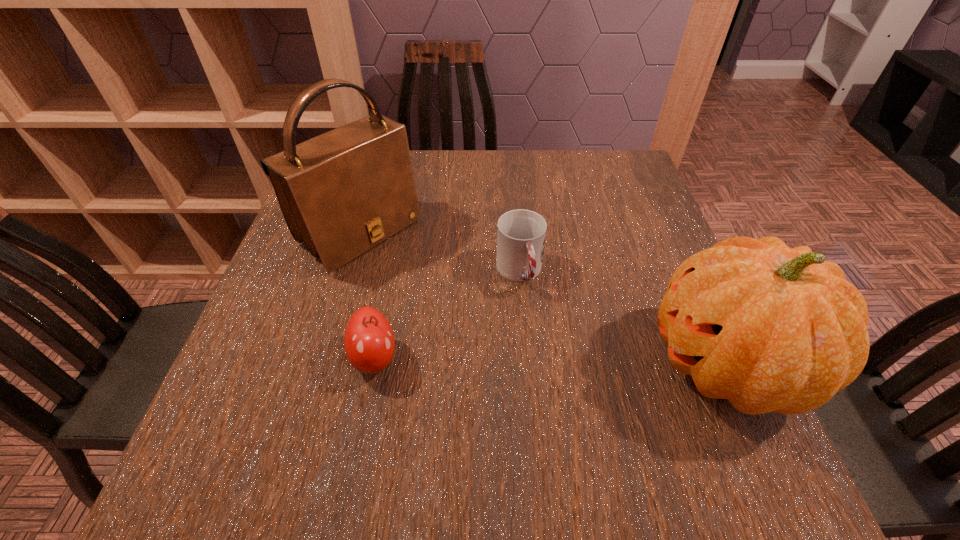
You are a GUI agent. You are given a task and a screenshot of the screen. Output one action in this format:
    pyautogui.click(x=<x>, y=<y>)
    Task: Click on the free spot between the tallest object and the rightmost object
    Image resolution: width=960 pixels, height=540 pixels.
    Given the screenshot: What is the action you would take?
    pyautogui.click(x=543, y=299)

This screenshot has width=960, height=540. I want to click on blank region between the rightmost object and the cup, so click(x=623, y=318).

You are a GUI agent. You are given a task and a screenshot of the screen. Output one action in this format:
    pyautogui.click(x=<x>, y=<y>)
    Task: Click on the free space that is in between the shoulder bag and the rightmost object
    The width and height of the screenshot is (960, 540).
    Given the screenshot: What is the action you would take?
    pyautogui.click(x=543, y=299)

The width and height of the screenshot is (960, 540). In order to click on free space between the apple and the tallest object in this screenshot , I will do `click(368, 296)`.

Identify the location of blank region between the tallest object and the second object from right to left. (440, 253).

Identify the location of unoccupied position between the tallest object and the second tallest object. The height and width of the screenshot is (540, 960). (543, 299).

Identify which object is the second closest to the tallest object. Please provide its 2D coordinates. Your answer should be formatted as a tuple, i.e. [(x, y)], where the tuple contains the x and y coordinates of a point satisfying the conditions above.

[(521, 233)]

Identify the location of object that can be found as the second closest to the cup. (343, 192).

This screenshot has width=960, height=540. Identify the location of free location that satisfies the following two spatial constraints: 1. on the back side of the apple; 2. on the left side of the third object from left to right. (392, 272).

Locate an element on the screen. This screenshot has width=960, height=540. free space that satisfies the following two spatial constraints: 1. on the front side of the second object from right to left; 2. on the carved face of the second tallest object is located at coordinates (527, 364).